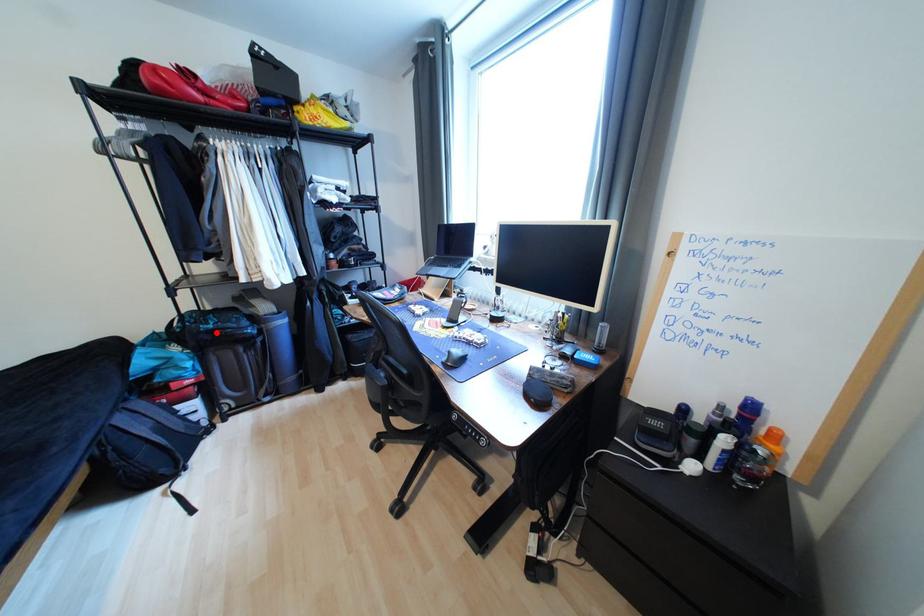
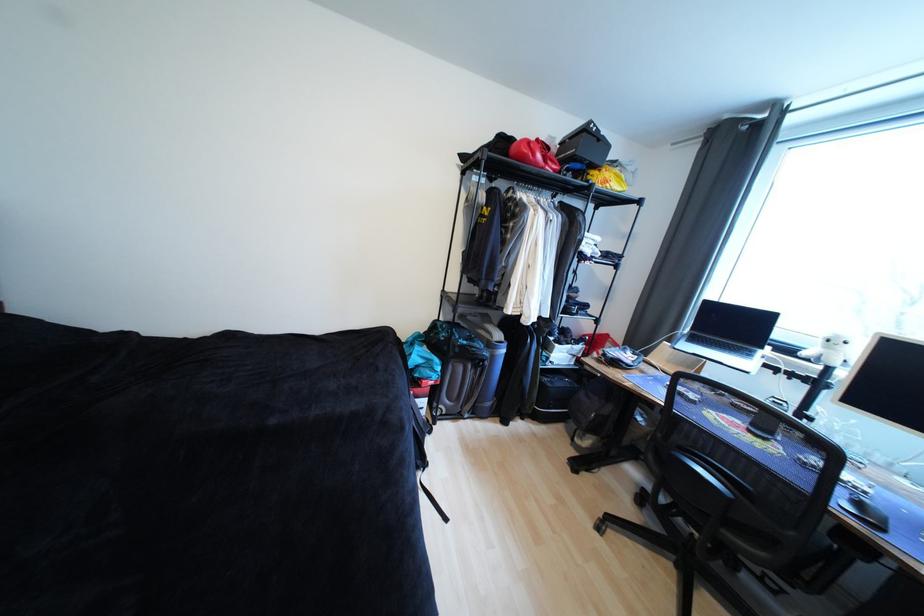
Where in the second image is the point corresponding to the highlighted location from the first image?

(469, 347)